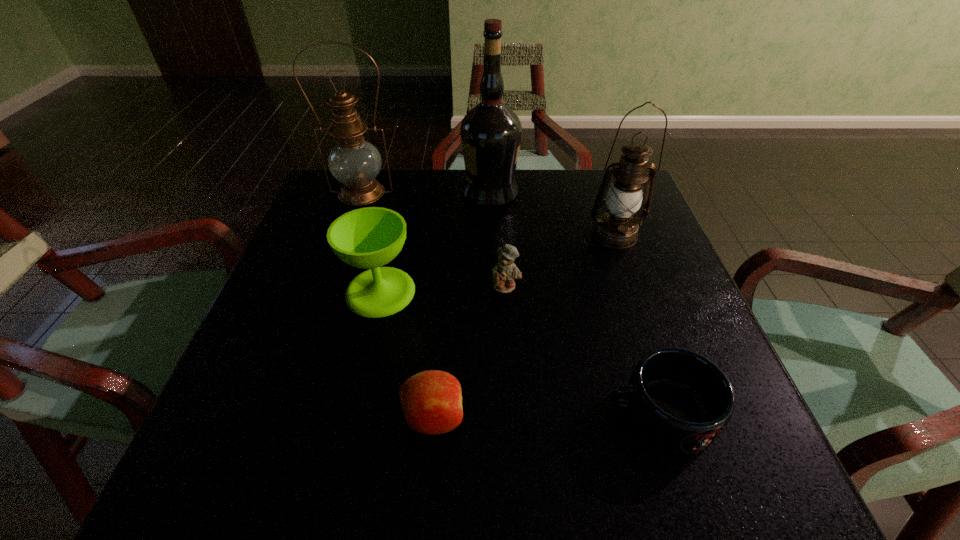
Find the location of `vacant space positioned on the surface of the liquor`. vacant space positioned on the surface of the liquor is located at coordinates (401, 192).

Find the location of a particular element. The height and width of the screenshot is (540, 960). free location located 0.130m on the front of the farther oil lamp is located at coordinates (346, 240).

At what (x,y) coordinates should I click in order to perform the action: click on vacant space located 0.230m on the front of the third farthest object. Please return your answer as a coordinate pair (x, y). Looking at the image, I should click on (647, 327).

Locate an element on the screen. The height and width of the screenshot is (540, 960). free space located on the front of the wineglass is located at coordinates click(367, 352).

I want to click on free space located on the front-facing side of the teddy bear, so click(x=509, y=338).

Locate an element on the screen. This screenshot has height=540, width=960. free space located 0.230m on the left of the apple is located at coordinates (258, 417).

You are a GUI agent. You are given a task and a screenshot of the screen. Output one action in this format:
    pyautogui.click(x=<x>, y=<y>)
    Task: Click on the free space located 0.240m with the handle on the side of the mug
    This screenshot has width=960, height=540.
    Given the screenshot: What is the action you would take?
    pyautogui.click(x=456, y=414)

You are a GUI agent. You are given a task and a screenshot of the screen. Output one action in this format:
    pyautogui.click(x=<x>, y=<y>)
    Task: Click on the vacant space located 0.160m with the handle on the side of the mug
    This screenshot has height=540, width=960.
    Given the screenshot: What is the action you would take?
    pyautogui.click(x=506, y=414)

Image resolution: width=960 pixels, height=540 pixels. What are the coordinates of `vacant space located 0.160m with the handle on the side of the mug` in the screenshot? It's located at (506, 414).

Where is `liquor situated at the far edge`? liquor situated at the far edge is located at coordinates (491, 132).